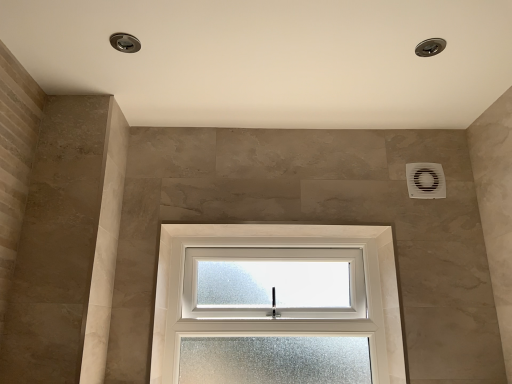
Question: Is white frosted glass window at center spatially inside white plastic air conditioning unit at upper right, or outside of it?

Choices:
 (A) outside
 (B) inside

Answer: (A)

Question: Considering the positions of point (257, 241) and point (430, 165), is point (257, 241) closer or farther from the camera than point (430, 165)?

Choices:
 (A) closer
 (B) farther

Answer: (B)

Question: From the image's perspective, relative to white plastic air conditioning unit at upper right, is white frosted glass window at center above or below?

Choices:
 (A) below
 (B) above

Answer: (A)

Question: Is white plastic air conditioning unit at upper right to the left or to the right of white frosted glass window at center in the image?

Choices:
 (A) left
 (B) right

Answer: (B)

Question: Is white plastic air conditioning unit at upper right spatially inside white frosted glass window at center, or outside of it?

Choices:
 (A) inside
 (B) outside

Answer: (B)

Question: Considering the positions of point (409, 165) and point (376, 291), is point (409, 165) closer or farther from the camera than point (376, 291)?

Choices:
 (A) farther
 (B) closer

Answer: (A)

Question: Considering the positions of white plastic air conditioning unit at upper right and white frosted glass window at center in the image, is white plastic air conditioning unit at upper right wider or thinner than white frosted glass window at center?

Choices:
 (A) wide
 (B) thin

Answer: (B)